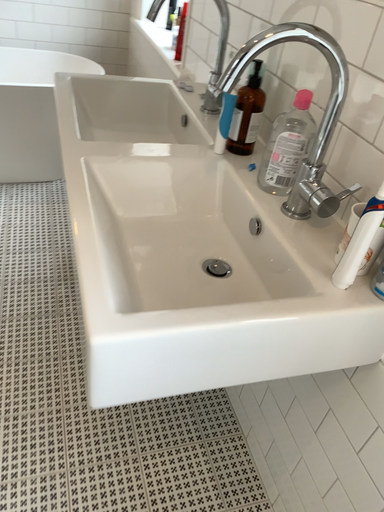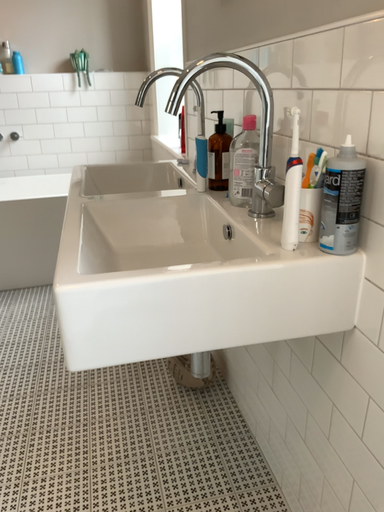
Question: Which way did the camera rotate in the video?

Choices:
 (A) rotated downward
 (B) rotated upward

Answer: (B)